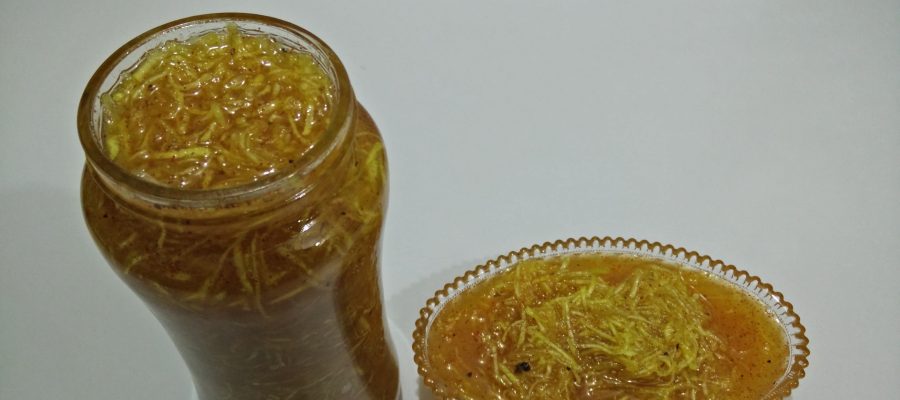
At what (x,y) coordinates should I click in order to perform the action: click on shadow of bowl on left. Please return your answer as a coordinate pair (x, y). The width and height of the screenshot is (900, 400). Looking at the image, I should click on (457, 263), (405, 300).